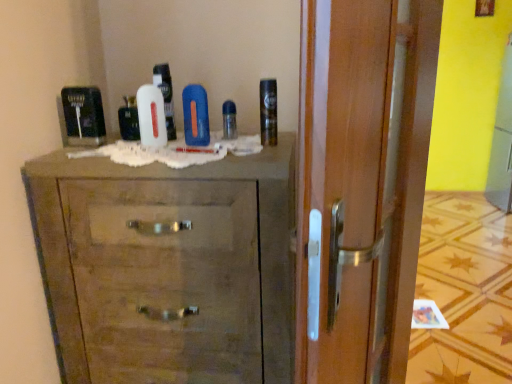
This screenshot has width=512, height=384. Find the location of `free location in front of white matte shaving cream at center, the 2th shaving cream positioned from the right`. free location in front of white matte shaving cream at center, the 2th shaving cream positioned from the right is located at coordinates (165, 147).